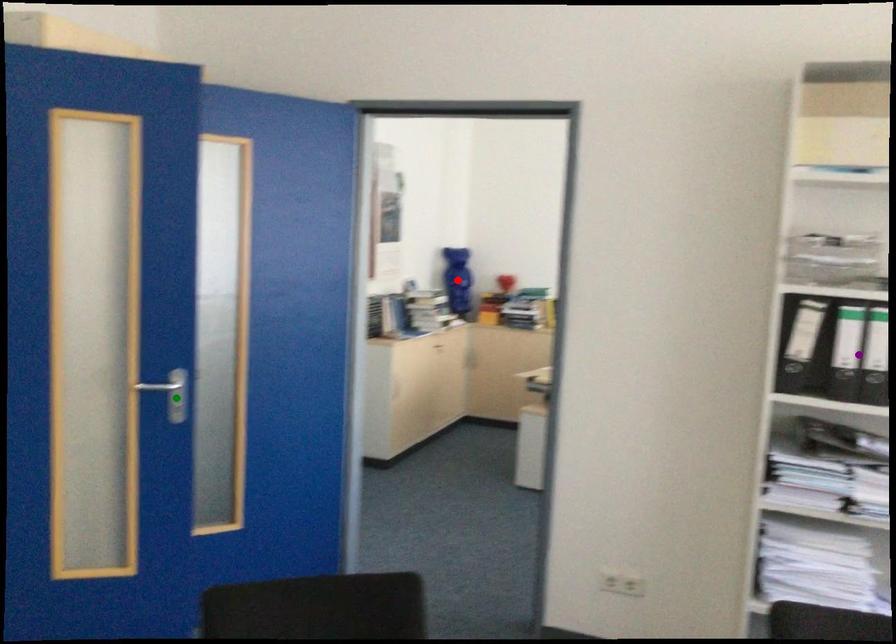
Order these from farthest to nearest:
- green point
- red point
- purple point

red point → green point → purple point